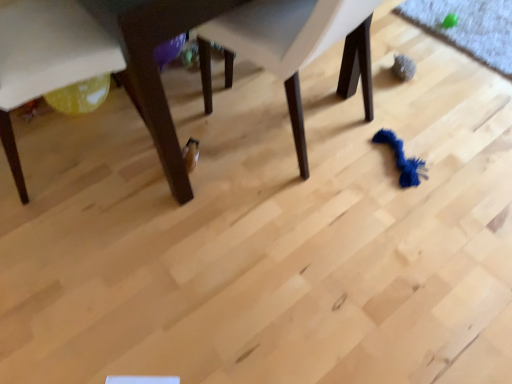
Question: Does matte white chair at lower left, acting as the second chair starting from the right, have a greater height compared to white plastic chair at center, marked as the 2th chair in a left-to-right arrangement?

Choices:
 (A) no
 (B) yes

Answer: (A)

Question: Is matte white chair at lower left, acting as the second chair starting from the right, thinner than white plastic chair at center, marked as the 2th chair in a left-to-right arrangement?

Choices:
 (A) yes
 (B) no

Answer: (A)

Question: Is matte white chair at lower left, acting as the second chair starting from the right, smaller than white plastic chair at center, marked as the 2th chair in a left-to-right arrangement?

Choices:
 (A) no
 (B) yes

Answer: (B)

Question: From the image's perspective, does matte white chair at lower left, acting as the second chair starting from the right, appear lower than white plastic chair at center, positioned as the 1th chair in right-to-left order?

Choices:
 (A) yes
 (B) no

Answer: (A)

Question: Is white plastic chair at center, positioned as the 1th chair in right-to-left order, at the back of matte white chair at lower left, placed as the first chair when sorted from left to right?

Choices:
 (A) yes
 (B) no

Answer: (B)

Question: Is the position of matte white chair at lower left, acting as the second chair starting from the right, more distant than that of white plastic chair at center, marked as the 2th chair in a left-to-right arrangement?

Choices:
 (A) no
 (B) yes

Answer: (B)

Question: Is wooden table at center bigger than white plastic chair at center, positioned as the 1th chair in right-to-left order?

Choices:
 (A) yes
 (B) no

Answer: (A)

Question: Is wooden table at center completely or partially outside of white plastic chair at center, positioned as the 1th chair in right-to-left order?

Choices:
 (A) yes
 (B) no

Answer: (A)

Question: Considering the relative positions of wooden table at center and white plastic chair at center, marked as the 2th chair in a left-to-right arrangement, in the image provided, is wooden table at center in front of white plastic chair at center, marked as the 2th chair in a left-to-right arrangement,?

Choices:
 (A) no
 (B) yes

Answer: (B)

Question: Is wooden table at center directly adjacent to white plastic chair at center, marked as the 2th chair in a left-to-right arrangement?

Choices:
 (A) yes
 (B) no

Answer: (B)

Question: Is white plastic chair at center, positioned as the 1th chair in right-to-left order, surrounded by wooden table at center?

Choices:
 (A) no
 (B) yes

Answer: (B)

Question: Is the depth of wooden table at center greater than that of white plastic chair at center, marked as the 2th chair in a left-to-right arrangement?

Choices:
 (A) yes
 (B) no

Answer: (B)

Question: From the image's perspective, would you say matte white chair at lower left, placed as the first chair when sorted from left to right, is positioned over wooden table at center?

Choices:
 (A) yes
 (B) no

Answer: (B)